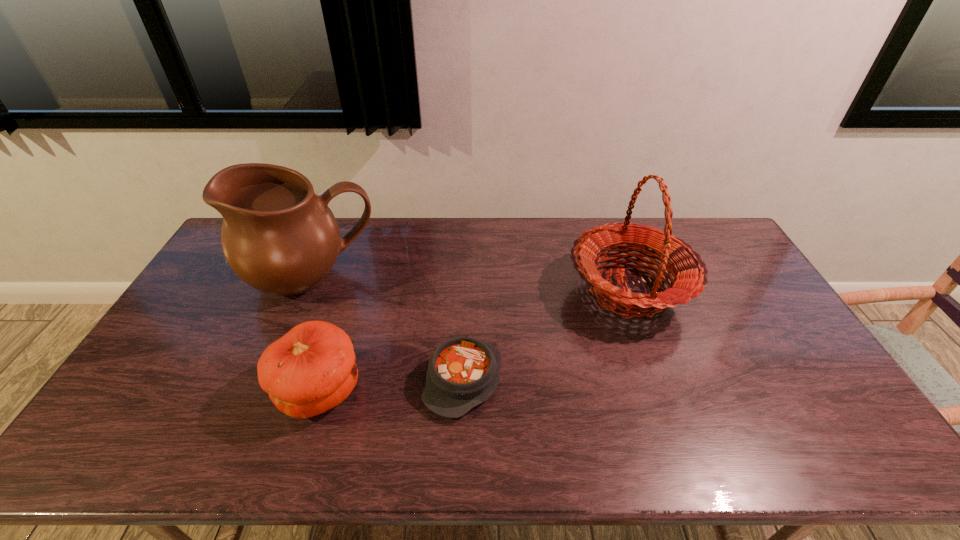
This screenshot has height=540, width=960. Identify the location of basket. [689, 272].

What are the coordinates of `cream pitcher` in the screenshot? It's located at (278, 236).

I want to click on the third tallest object, so click(x=311, y=369).

The image size is (960, 540). Identify the location of the third object from left to right. (463, 372).

I want to click on casserole, so click(x=463, y=372).

Identify the location of vacant region located 0.190m on the left of the rightmost object. 508,292.

Locate an element on the screen. The width and height of the screenshot is (960, 540). vacant space located at the spout of the cream pitcher is located at coordinates (280, 354).

Image resolution: width=960 pixels, height=540 pixels. What are the coordinates of `vacant space located 0.330m on the back of the third tallest object` in the screenshot? It's located at (355, 279).

Locate an element on the screen. free space located 0.150m on the left of the shortest object is located at coordinates (369, 380).

Identify the location of basket positioned at the far edge. This screenshot has width=960, height=540. (689, 272).